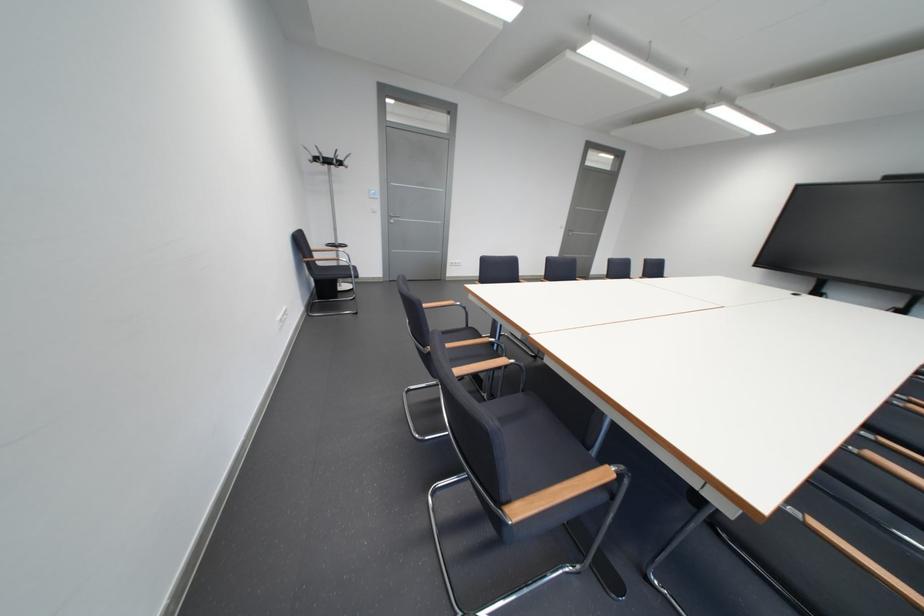
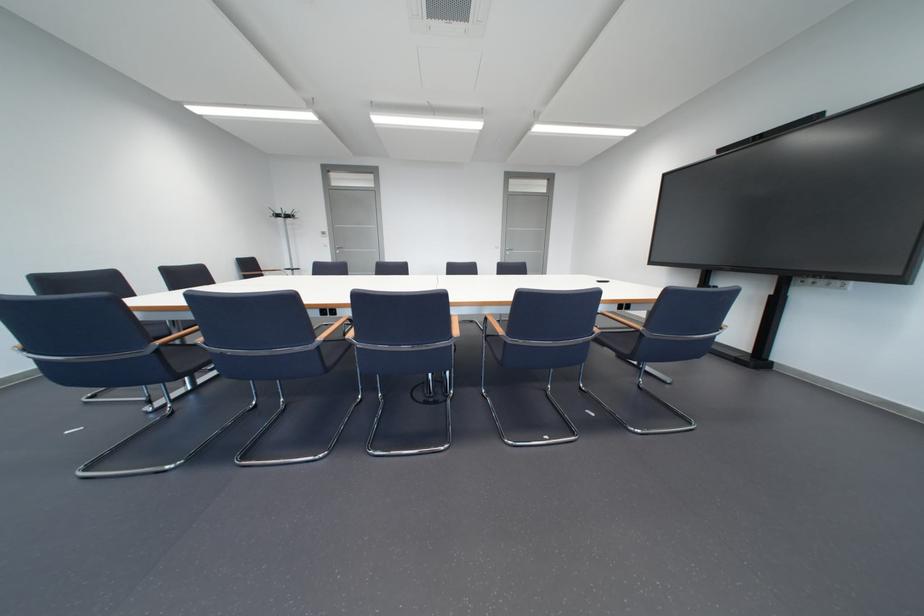
Question: The images are taken continuously from a first-person perspective. In which direction are you moving?

Choices:
 (A) Left
 (B) Right
 (C) Forward
 (D) Backward

Answer: (B)